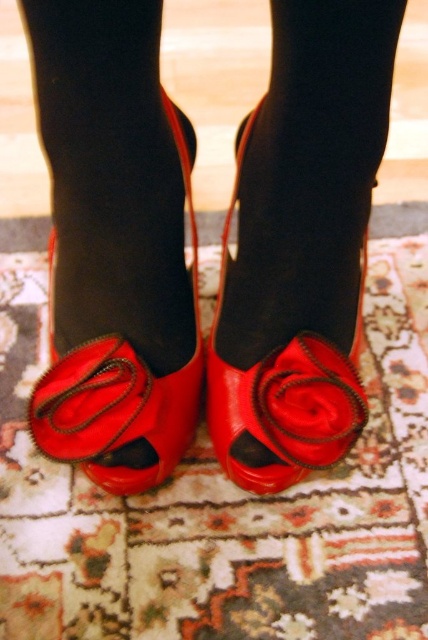
You are a photographer trying to capture the shiny patent leather sandal at center and the shiny leather sandal at center. Which one is positioned lower in the image?

The shiny patent leather sandal at center is located below the shiny leather sandal at center, so it is positioned lower in the image.

You are a fashion designer examining a model wearing the shiny patent leather sandal at center. The model is standing on a patterned rug with intricate designs. You need to place a decorative rose exactly where the sandal is currently positioned. Can you confirm the coordinates where you should place the rose?

The shiny patent leather sandal at center is located at point (118, 388), so you should place the decorative rose at those coordinates.

You are a photographer setting up a shoot and need to position a light source to the right of the shiny red rose at center. Will the light also illuminate the shiny leather sandal at center?

The shiny leather sandal at center is to the left of the shiny red rose at center, so placing the light to the right of the rose would still allow light to reach the sandal, but it might cast a shadow depending on the light intensity and angle.